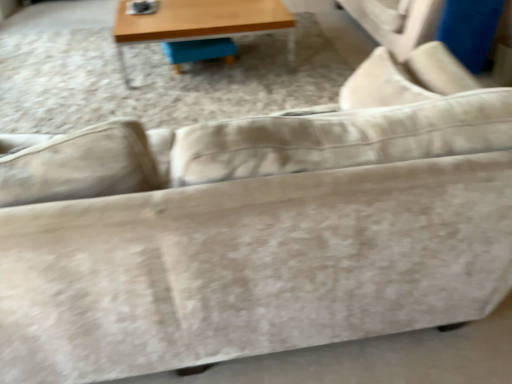
The height and width of the screenshot is (384, 512). In order to click on vacant area that is in front of blue fabric swivel chair at center in this screenshot , I will do `click(200, 80)`.